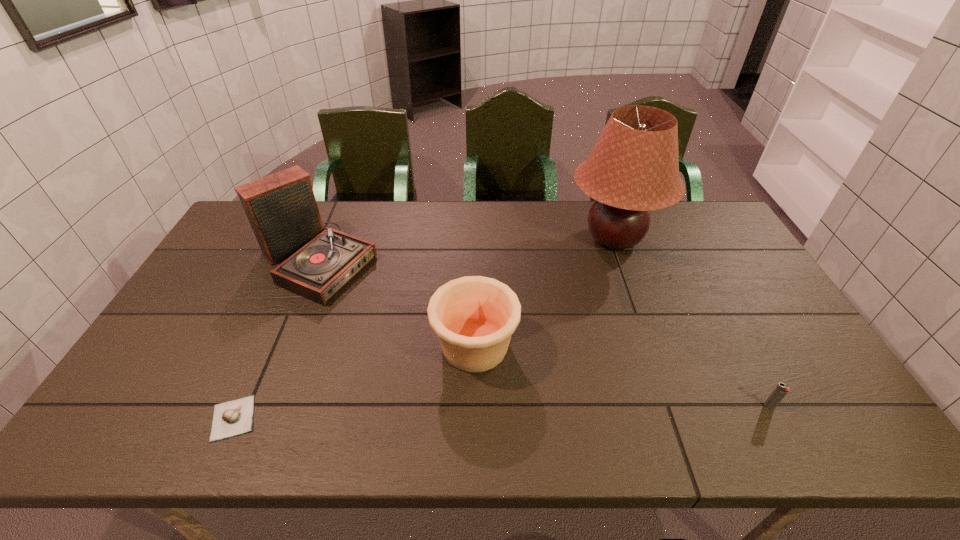
Identify the location of blank space located 0.240m on the front-facing side of the fourth object from left to right. (494, 239).

At what (x,y) coordinates should I click in order to perform the action: click on free space located 0.330m on the front of the second tallest object. Please return your answer as a coordinate pair (x, y). Looking at the image, I should click on (255, 410).

At what (x,y) coordinates should I click in order to perform the action: click on free location located 0.180m on the right of the third nearest object. Please return your answer as a coordinate pair (x, y). Looking at the image, I should click on (587, 346).

At what (x,y) coordinates should I click in order to perform the action: click on vacant space situated 0.130m on the right of the second shortest object. Please return your answer as a coordinate pair (x, y). This screenshot has height=540, width=960. Looking at the image, I should click on (829, 406).

Locate an element on the screen. The height and width of the screenshot is (540, 960). blank space located 0.080m on the right of the shortest object is located at coordinates (293, 418).

Identify the location of lampshade that is at the far edge. The height and width of the screenshot is (540, 960). (633, 168).

Locate an element on the screen. Image resolution: width=960 pixels, height=540 pixels. phonograph record that is at the far edge is located at coordinates (281, 208).

Locate an element on the screen. The height and width of the screenshot is (540, 960). igniter present at the near edge is located at coordinates (781, 390).

Where is `garlic present at the near edge`? The height and width of the screenshot is (540, 960). garlic present at the near edge is located at coordinates (235, 417).

Find the location of a particular element. The height and width of the screenshot is (540, 960). object that is at the left edge is located at coordinates (281, 208).